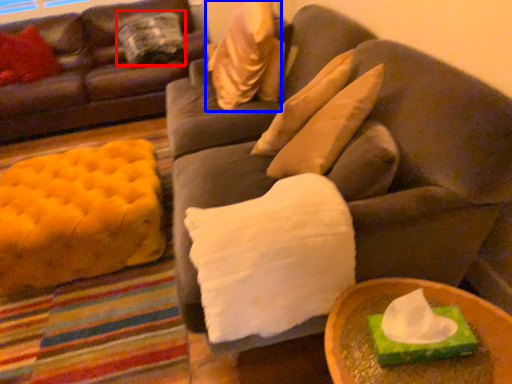
Question: Among these objects, which one is farthest to the camera, pillow (highlighted by a red box) or pillow (highlighted by a blue box)?

Choices:
 (A) pillow
 (B) pillow

Answer: (A)